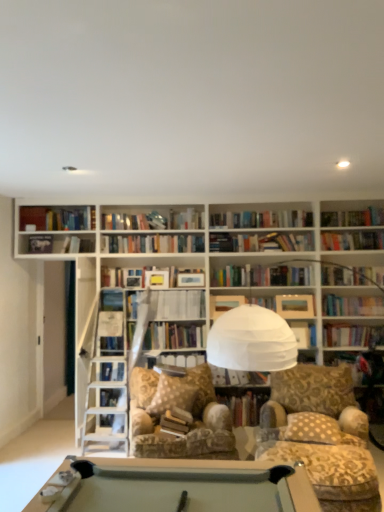
Locate an element on the screen. empty space that is ontop of hardcover book at center, marked as the 3th book in a bottom-to-top arrangement is located at coordinates (183, 205).